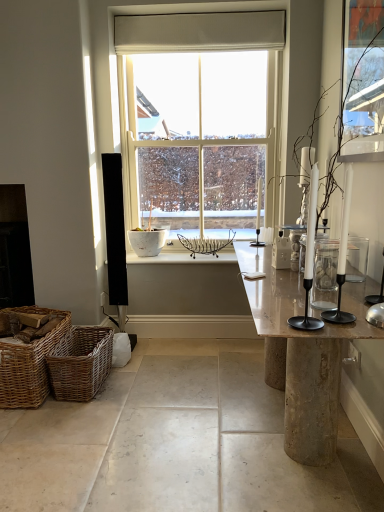
Question: Is woven brown picnic basket at lower left, which is counted as the second picnic basket, starting from the left, bigger than black glass fireplace at left?

Choices:
 (A) yes
 (B) no

Answer: (B)

Question: Does woven brown picnic basket at lower left, arranged as the 1th picnic basket when viewed from the right, have a greater height compared to black glass fireplace at left?

Choices:
 (A) no
 (B) yes

Answer: (A)

Question: Does woven brown picnic basket at lower left, which is counted as the second picnic basket, starting from the left, come behind black glass fireplace at left?

Choices:
 (A) no
 (B) yes

Answer: (A)

Question: Is woven brown picnic basket at lower left, arranged as the 1th picnic basket when viewed from the right, wider than black glass fireplace at left?

Choices:
 (A) yes
 (B) no

Answer: (A)

Question: From the image's perspective, would you say woven brown picnic basket at lower left, arranged as the 1th picnic basket when viewed from the right, is positioned over black glass fireplace at left?

Choices:
 (A) no
 (B) yes

Answer: (A)

Question: Does woven brown picnic basket at lower left, arranged as the 1th picnic basket when viewed from the right, come in front of black glass fireplace at left?

Choices:
 (A) yes
 (B) no

Answer: (A)

Question: Is marble table at center inside black glass fireplace at left?

Choices:
 (A) no
 (B) yes

Answer: (A)

Question: Is black glass fireplace at left smaller than marble table at center?

Choices:
 (A) yes
 (B) no

Answer: (A)

Question: Considering the relative positions of black glass fireplace at left and marble table at center in the image provided, is black glass fireplace at left in front of marble table at center?

Choices:
 (A) yes
 (B) no

Answer: (B)

Question: From the image's perspective, is black glass fireplace at left on top of marble table at center?

Choices:
 (A) yes
 (B) no

Answer: (A)

Question: Considering the relative positions of black glass fireplace at left and marble table at center in the image provided, is black glass fireplace at left to the left of marble table at center from the viewer's perspective?

Choices:
 (A) yes
 (B) no

Answer: (A)

Question: Is black glass fireplace at left looking in the opposite direction of marble table at center?

Choices:
 (A) yes
 (B) no

Answer: (B)

Question: From a real-world perspective, is clear glass jar at right over woven brown picnic basket at lower left, which appears as the first picnic basket when viewed from the left?

Choices:
 (A) yes
 (B) no

Answer: (A)